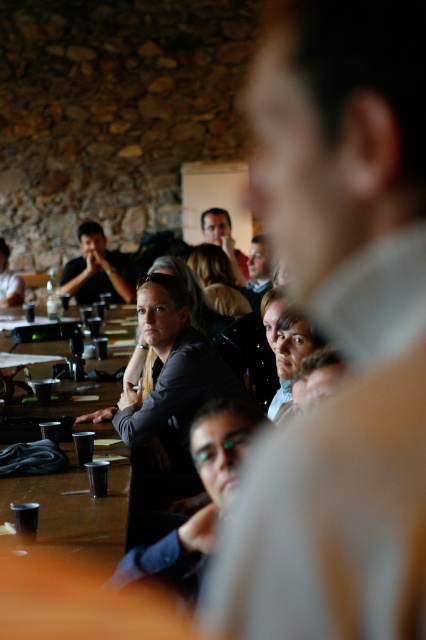
Question: Which of the following is the farthest from the observer?

Choices:
 (A) (86, 243)
 (B) (104, 524)

Answer: (A)

Question: Which point appears farthest from the camera in this image?

Choices:
 (A) (43, 490)
 (B) (132, 273)

Answer: (B)

Question: Does brown wooden table at lower left have a larger size compared to matte black shirt at center?

Choices:
 (A) yes
 (B) no

Answer: (B)

Question: Is brown wooden table at lower left bigger than matte black shirt at center?

Choices:
 (A) no
 (B) yes

Answer: (A)

Question: Is brown wooden table at lower left below matte black shirt at center?

Choices:
 (A) no
 (B) yes

Answer: (B)